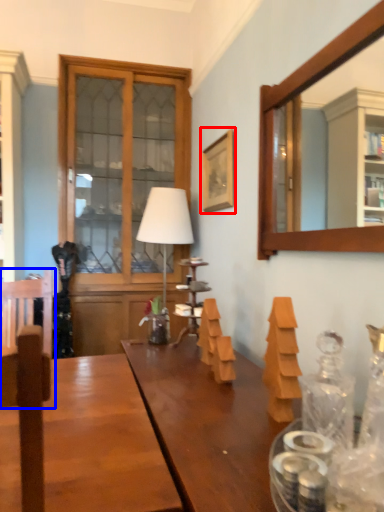
Question: Which point is closer to the camera, picture frame (highlighted by a red box) or swivel chair (highlighted by a blue box)?

Choices:
 (A) picture frame
 (B) swivel chair

Answer: (B)